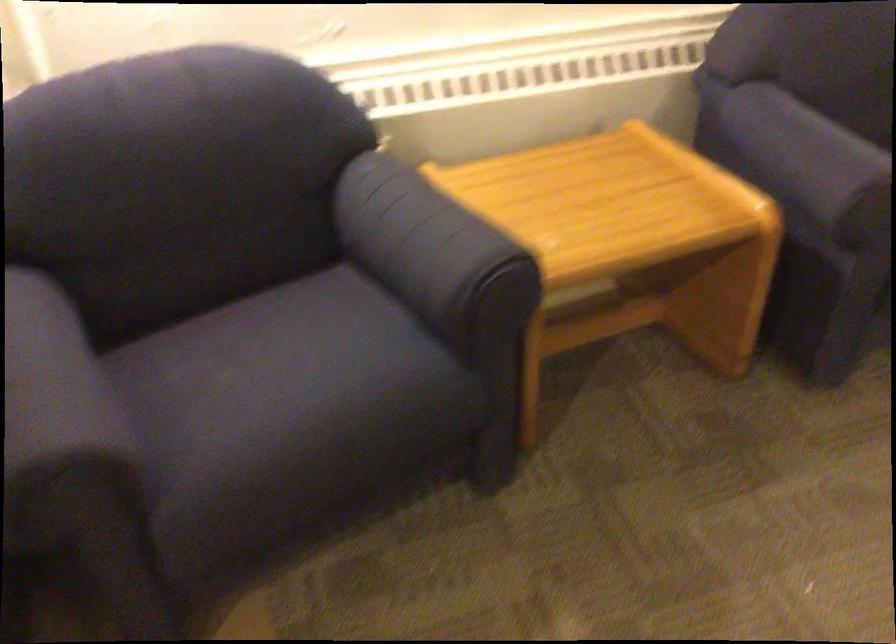
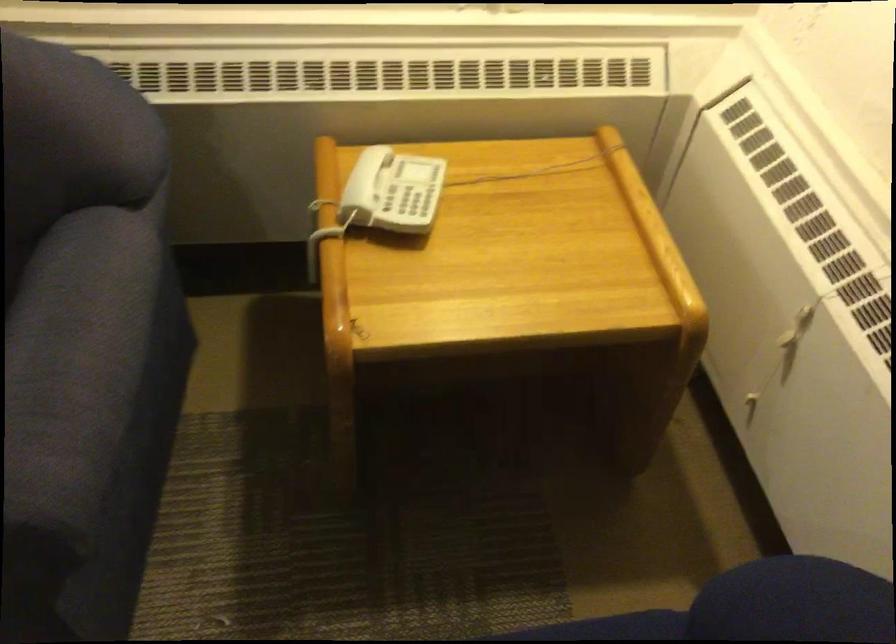
Which direction would the cameraman need to move to produce the second image?

The cameraman walked toward right, forward.